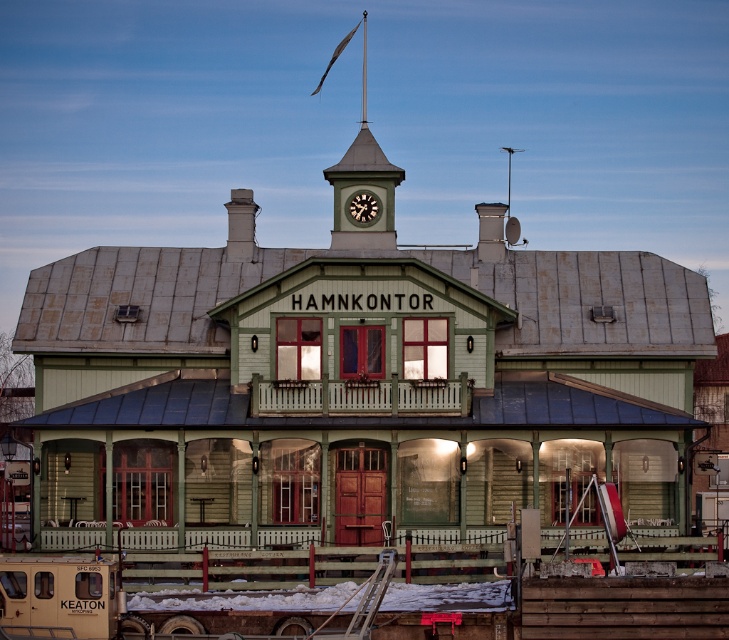
Which of these two, metallic spire at upper center or matte black clock at upper center, stands taller?

metallic spire at upper center is taller.

Does metallic spire at upper center lie in front of matte black clock at upper center?

No, metallic spire at upper center is behind matte black clock at upper center.

Is point (335, 225) positioned in front of point (370, 216)?

No.

At what (x,y) coordinates should I click in order to perform the action: click on metallic spire at upper center. Please return your answer as a coordinate pair (x, y). The width and height of the screenshot is (729, 640). Looking at the image, I should click on (362, 188).